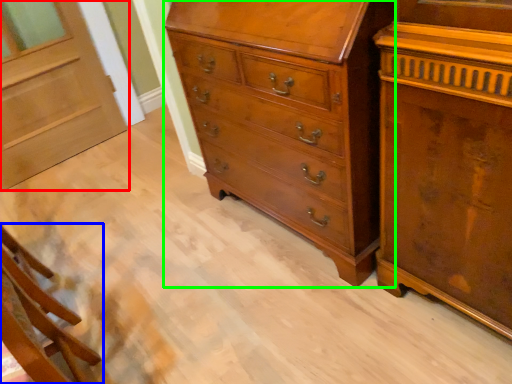
Question: Considering the real-world distances, which object is closest to door (highlighted by a red box)? furniture (highlighted by a blue box) or chest of drawers (highlighted by a green box).

Choices:
 (A) furniture
 (B) chest of drawers

Answer: (A)